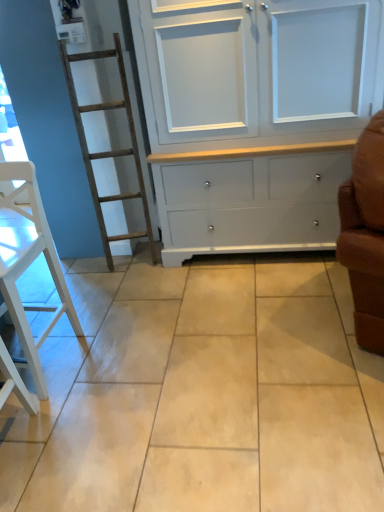
Question: Is white painted wood cupboard at center positioned far away from beige ceramic tile at center?

Choices:
 (A) yes
 (B) no

Answer: (B)

Question: Is white painted wood cupboard at center positioned with its back to beige ceramic tile at center?

Choices:
 (A) yes
 (B) no

Answer: (B)

Question: Considering the relative positions of white painted wood cupboard at center and beige ceramic tile at center in the image provided, is white painted wood cupboard at center to the right of beige ceramic tile at center from the viewer's perspective?

Choices:
 (A) no
 (B) yes

Answer: (B)

Question: From the image's perspective, would you say white painted wood cupboard at center is shown under beige ceramic tile at center?

Choices:
 (A) yes
 (B) no

Answer: (B)

Question: Can you confirm if white painted wood cupboard at center is thinner than beige ceramic tile at center?

Choices:
 (A) yes
 (B) no

Answer: (A)

Question: Looking at their shapes, would you say white wood chair at left is wider or thinner than beige ceramic tile at center?

Choices:
 (A) wide
 (B) thin

Answer: (B)

Question: From the image's perspective, is white wood chair at left above or below beige ceramic tile at center?

Choices:
 (A) below
 (B) above

Answer: (B)

Question: Looking at the image, does white wood chair at left seem bigger or smaller compared to beige ceramic tile at center?

Choices:
 (A) small
 (B) big

Answer: (A)

Question: Relative to beige ceramic tile at center, is white wood chair at left in front or behind?

Choices:
 (A) front
 (B) behind

Answer: (B)

Question: Looking at the image, does white painted wood cupboard at center seem bigger or smaller compared to beige ceramic tile at center?

Choices:
 (A) small
 (B) big

Answer: (B)

Question: Which is correct: white painted wood cupboard at center is inside beige ceramic tile at center, or outside of it?

Choices:
 (A) outside
 (B) inside

Answer: (A)

Question: Considering the positions of point (271, 47) and point (281, 384), is point (271, 47) closer or farther from the camera than point (281, 384)?

Choices:
 (A) closer
 (B) farther

Answer: (B)

Question: From their relative heights in the image, would you say white painted wood cupboard at center is taller or shorter than beige ceramic tile at center?

Choices:
 (A) short
 (B) tall

Answer: (B)

Question: Looking at the image, does beige ceramic tile at center seem bigger or smaller compared to white wood chair at left?

Choices:
 (A) small
 (B) big

Answer: (B)

Question: From a real-world perspective, is beige ceramic tile at center positioned above or below white wood chair at left?

Choices:
 (A) below
 (B) above

Answer: (A)